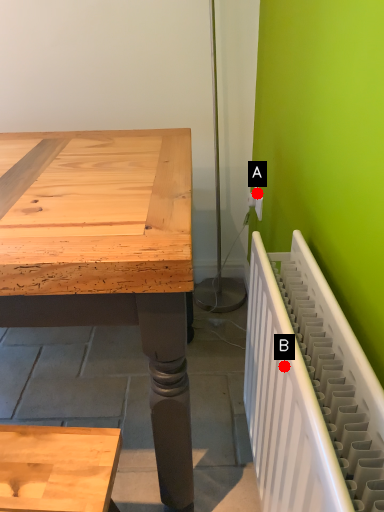
Question: Two points are circled on the image, labeled by A and B beside each circle. Which point is further to the camera?

Choices:
 (A) A is further
 (B) B is further

Answer: (A)